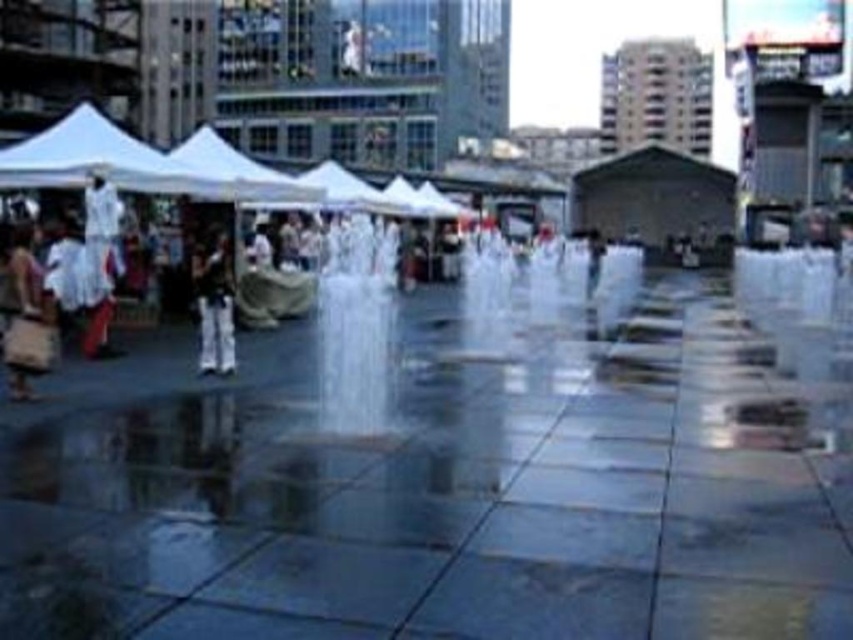
You are a city planner assessing the plaza layout. The clear glass fountain at center and the white fabric canopy at center are both central to the design. Which object occupies a smaller horizontal space in the plaza?

The clear glass fountain at center has a smaller width than the white fabric canopy at center, so it occupies a smaller horizontal space in the plaza.